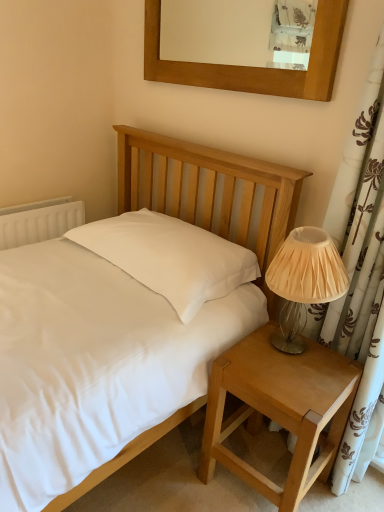
Question: In the image, is wooden picture frame at upper center on the left side or the right side of matte white bed at center?

Choices:
 (A) right
 (B) left

Answer: (A)

Question: Do you think wooden picture frame at upper center is within matte white bed at center, or outside of it?

Choices:
 (A) inside
 (B) outside

Answer: (B)

Question: Which is nearer to the ivory pleated fabric lampshade at right?

Choices:
 (A) wooden picture frame at upper center
 (B) light brown wood nightstand at lower right
 (C) matte white bed at center
 (D) white plastic radiator at left

Answer: (B)

Question: Estimate the real-world distances between objects in this image. Which object is farther from the wooden picture frame at upper center?

Choices:
 (A) light brown wood nightstand at lower right
 (B) ivory pleated fabric lampshade at right
 (C) matte white bed at center
 (D) white plastic radiator at left

Answer: (A)